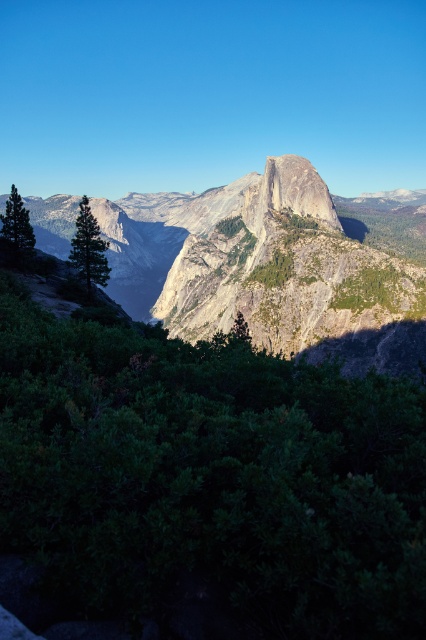
You are standing at the base of the mountain and see the point labeled as point (210,476) in the image. What is the object located at that coordinate?

The point (210,476) corresponds to a green leafy shrub at center.

You are a hiker planning to take a photo of the mountain peak with both the green leafy tree at left and the green leafy tree at center in the frame. Which tree should you position closer to the mountain peak to ensure both are visible in your photo?

You should position the green leafy tree at left closer to the mountain peak because it is larger in size compared to the green leafy tree at center, making it more likely to be visible even when placed farther back.